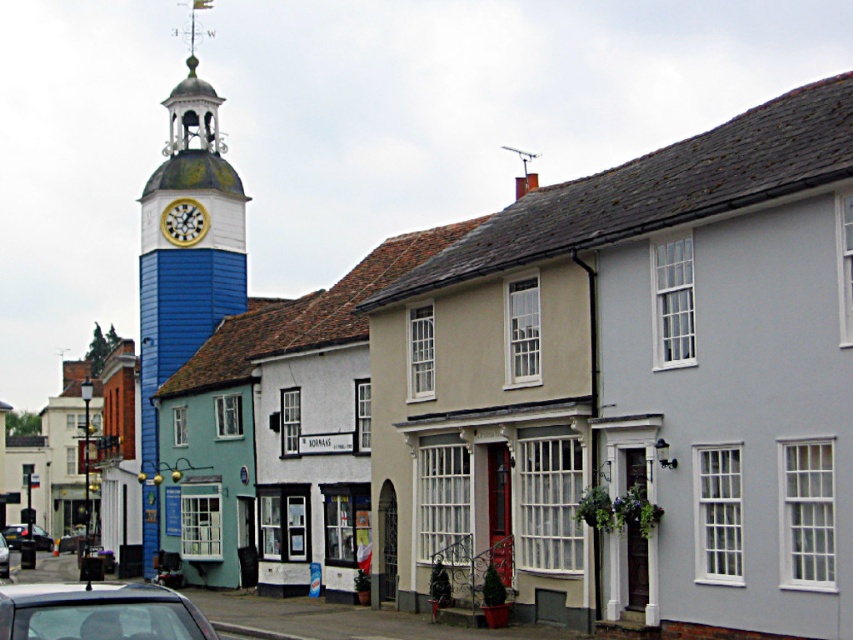
Does blue painted wood clock tower at left lie in front of metallic gray car at lower left?

No, blue painted wood clock tower at left is behind metallic gray car at lower left.

Where is `blue painted wood clock tower at left`? blue painted wood clock tower at left is located at coordinates (184, 262).

In the scene shown: Who is shorter, gold metallic clock at upper center or metallic gray car at lower left?

metallic gray car at lower left is shorter.

Which is below, gold metallic clock at upper center or metallic gray car at lower left?

metallic gray car at lower left

The height and width of the screenshot is (640, 853). In order to click on gold metallic clock at upper center in this screenshot , I will do `click(183, 221)`.

Between matte black car at lower left and gold metallic clock at upper center, which one appears on the right side from the viewer's perspective?

matte black car at lower left

Between point (125, 593) and point (196, 221), which one is positioned behind?

Positioned behind is point (196, 221).

The image size is (853, 640). Identify the location of matte black car at lower left. (97, 612).